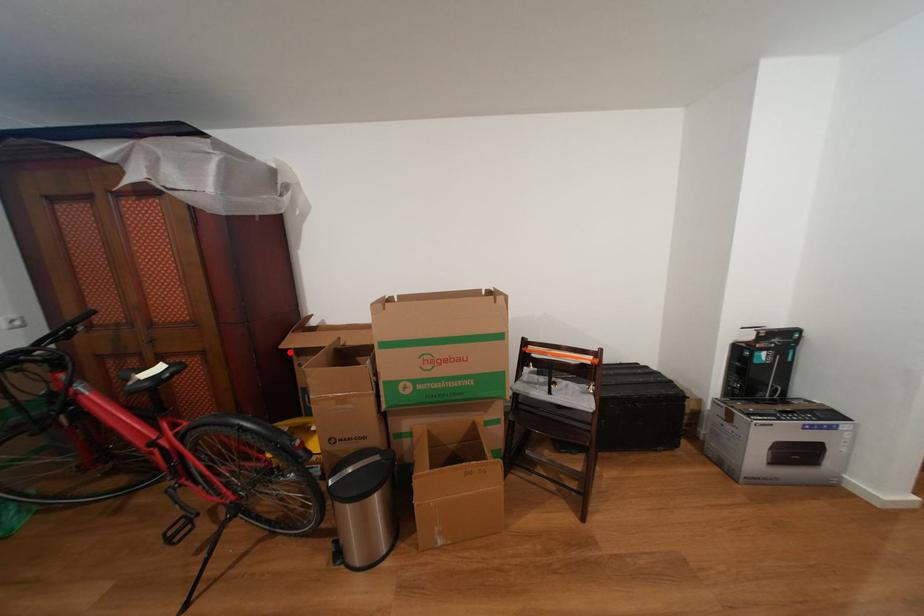
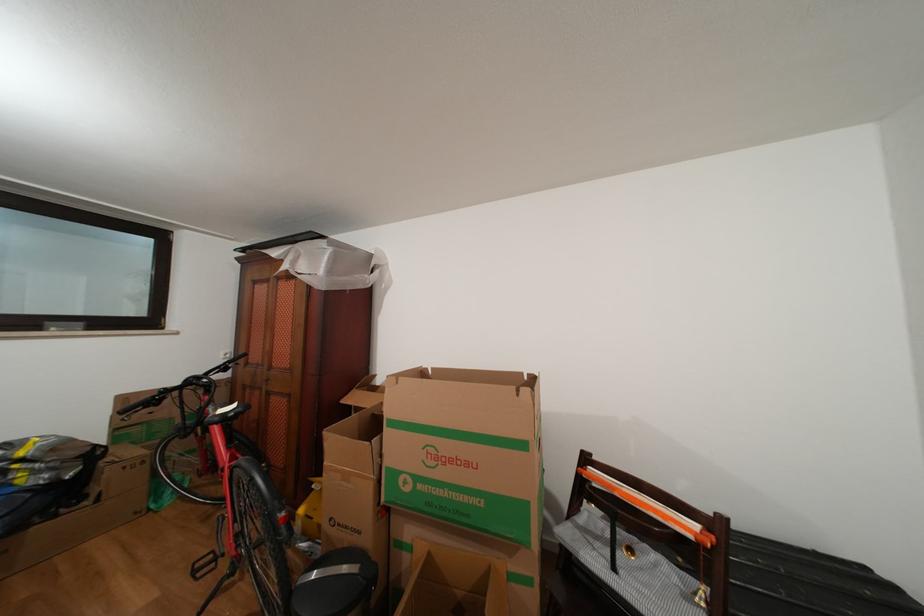
In the second image, find the point that corresponds to the highlighted location in the first image.

(350, 407)